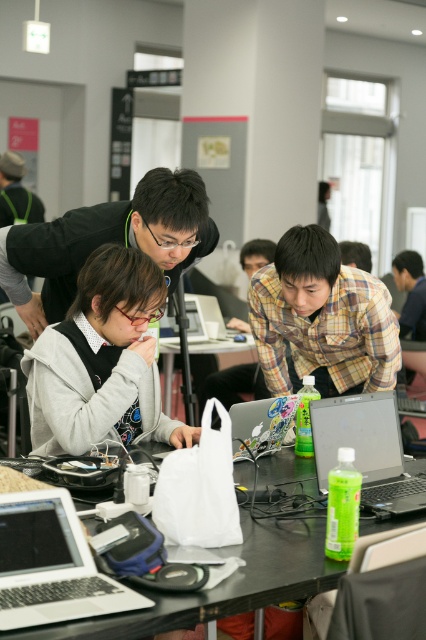
Between point (261, 410) and point (207, 296), which one is positioned behind?

The point (207, 296) is more distant.

Does metallic silver laptop at center appear on the right side of silver metallic laptop at center?

Yes, metallic silver laptop at center is to the right of silver metallic laptop at center.

Describe the element at coordinates (261, 424) in the screenshot. I see `metallic silver laptop at center` at that location.

Where is `metallic silver laptop at center`? metallic silver laptop at center is located at coordinates (261, 424).

Image resolution: width=426 pixels, height=640 pixels. In order to click on white plastic bag at center in this screenshot , I will do `click(221, 353)`.

Between white plastic bag at center and matte black laptop at center, which one has less height?

Standing shorter between the two is matte black laptop at center.

Who is more forward, [215,353] or [186,308]?

Point [186,308]

Locate an element on the screen. The width and height of the screenshot is (426, 640). white plastic bag at center is located at coordinates (221, 353).

Is black plastic table at center taller than silver metallic laptop at center?

No.

Can you confirm if black plastic table at center is smaller than silver metallic laptop at center?

No.

Which is in front, point (218, 595) or point (235, 310)?

Point (218, 595) is more forward.

The image size is (426, 640). I want to click on black plastic table at center, so click(224, 584).